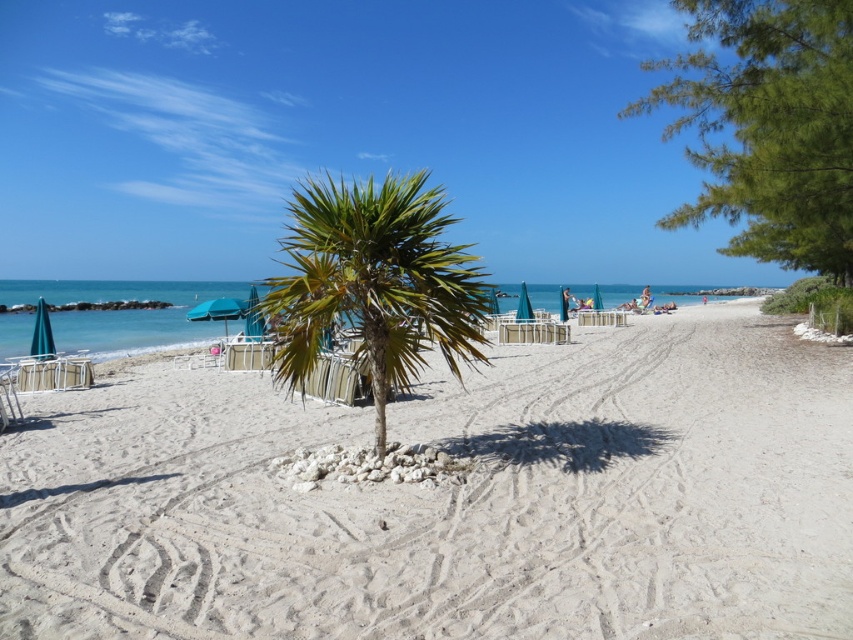
Question: From the image, what is the correct spatial relationship of white sandy beach at center in relation to green leafy palm tree at center?

Choices:
 (A) right
 (B) left

Answer: (A)

Question: Estimate the real-world distances between objects in this image. Which object is closer to the teal fabric umbrella at center?

Choices:
 (A) white sandy beach at center
 (B) green leafy palm tree at center
 (C) teal fabric umbrella at left

Answer: (A)

Question: Which is farther from the teal fabric umbrella at center?

Choices:
 (A) white sandy beach at center
 (B) blue fabric umbrella at center
 (C) teal fabric umbrella at left
 (D) green leafy palm tree at center

Answer: (C)

Question: Does green leafy palm tree at center have a smaller size compared to blue fabric umbrella at center?

Choices:
 (A) yes
 (B) no

Answer: (A)

Question: Which object appears closest to the camera in this image?

Choices:
 (A) green leafy palm tree at center
 (B) blue fabric umbrella at center
 (C) teal fabric umbrella at left
 (D) white sandy beach at center

Answer: (D)

Question: Is white sandy beach at center bigger than green leafy palm tree at center?

Choices:
 (A) yes
 (B) no

Answer: (A)